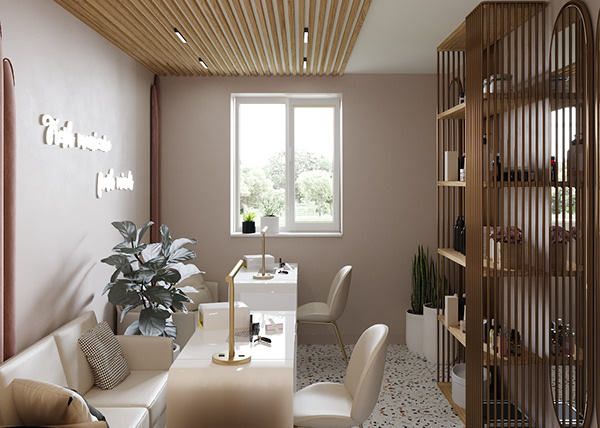
Find the location of a particular element. Image resolution: width=600 pixels, height=428 pixels. ivory couch is located at coordinates (118, 394).